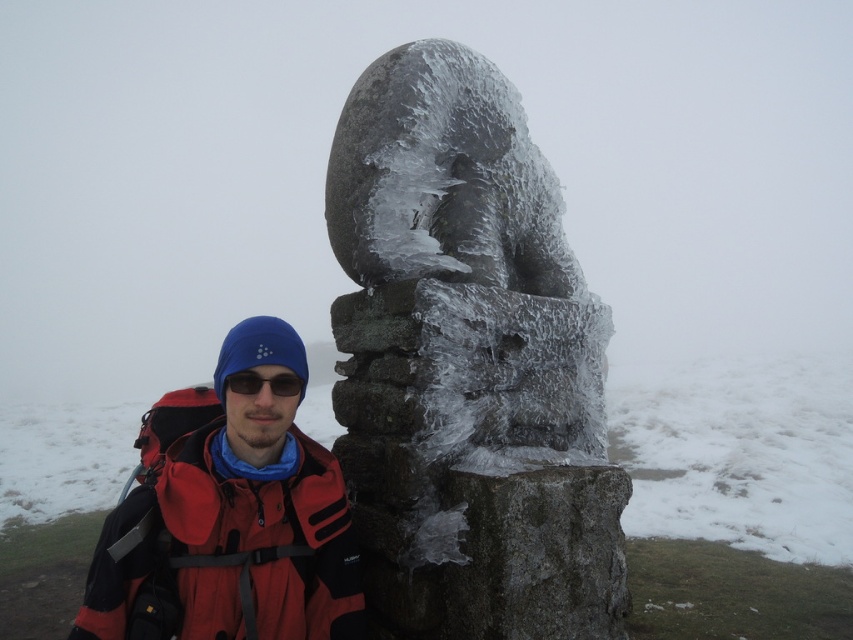
You are the person in the image and you want to take a photo of the icy stone sculpture at center without the red matte jacket at lower left appearing in the frame. How should you adjust your position?

The icy stone sculpture at center is above the red matte jacket at lower left. To avoid the jacket in the photo, you can move your position to the left or right so that the jacket is no longer in the same horizontal plane as the sculpture.

You are planning to build a snowman using the white frosty snow at center and the icy stone sculpture at center. Which material would be more suitable for the base of the snowman?

The white frosty snow at center is more suitable for the base of the snowman because it is thicker than the icy stone sculpture at center, providing better stability and volume for the structure.

You are a photographer planning to take a photo of the icy stone sculpture at center. You want to ensure the sculpture is centered in the frame. Given that the sculpture is represented by the point coordinates point (467, 364), will the sculpture be centered in the photo?

The icy stone sculpture at center is represented by the point coordinates point (467, 364). Since the coordinates are close to the center of the image, the sculpture will be centered in the frame.